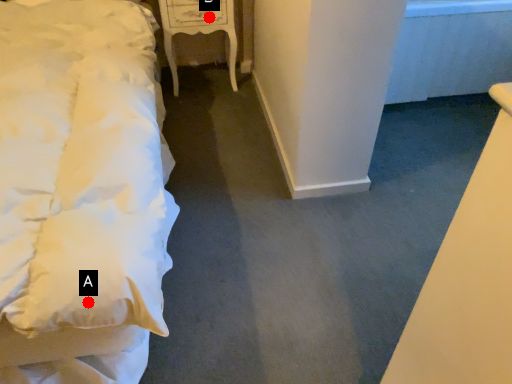
Question: Two points are circled on the image, labeled by A and B beside each circle. Which of the following is the closest to the observer?

Choices:
 (A) A is closer
 (B) B is closer

Answer: (A)